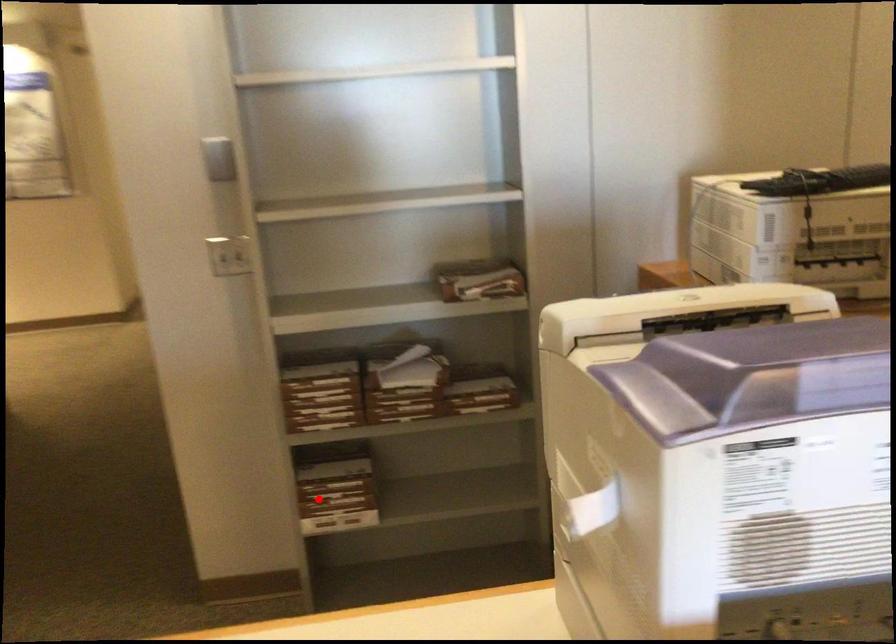
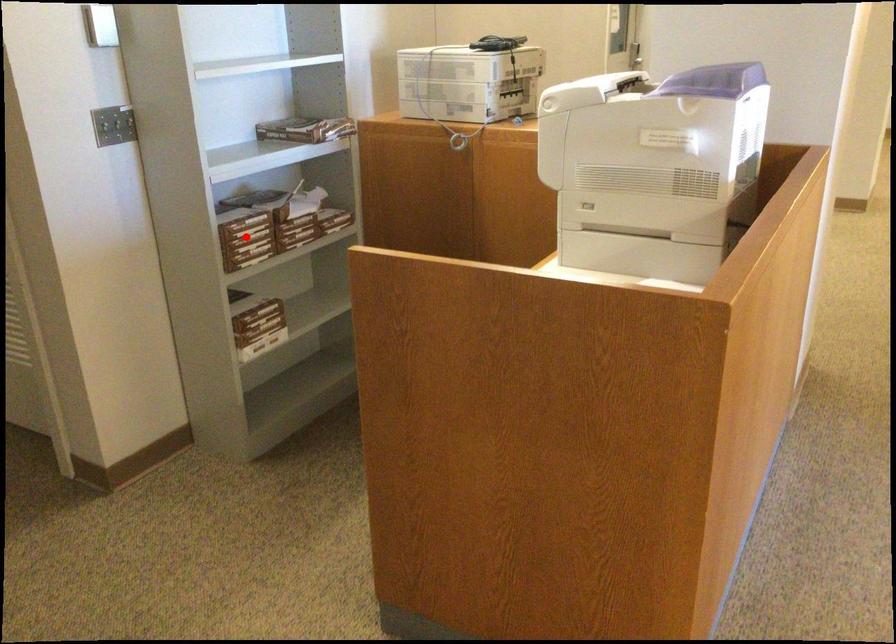
I am providing you with two images of the same scene from different viewpoints. A red point is marked on the first image and another point is marked on the second image. Is the red point in image1 aligned with the point shown in image2?

No